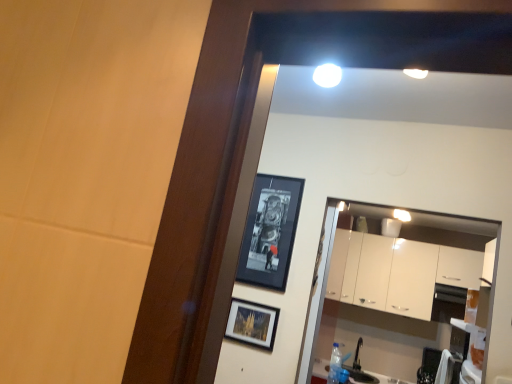
Question: Is black glossy picture frame at upper center, the first picture frame from the top, outside of white glossy cabinets at center?

Choices:
 (A) yes
 (B) no

Answer: (A)

Question: Considering the relative sizes of black glossy picture frame at upper center, the first picture frame from the top, and white glossy cabinets at center in the image provided, is black glossy picture frame at upper center, the first picture frame from the top, bigger than white glossy cabinets at center?

Choices:
 (A) no
 (B) yes

Answer: (A)

Question: From the image's perspective, is black glossy picture frame at upper center, the first picture frame from the top, over white glossy cabinets at center?

Choices:
 (A) no
 (B) yes

Answer: (B)

Question: Is black glossy picture frame at upper center, the first picture frame from the top, taller than white glossy cabinets at center?

Choices:
 (A) no
 (B) yes

Answer: (A)

Question: Are black glossy picture frame at upper center, which is counted as the second picture frame, starting from the bottom, and white glossy cabinets at center located far from each other?

Choices:
 (A) no
 (B) yes

Answer: (B)

Question: From the image's perspective, is white glossy cabinets at center above or below black glossy picture frame at upper center, the first picture frame from the top?

Choices:
 (A) below
 (B) above

Answer: (A)

Question: From a real-world perspective, is white glossy cabinets at center above or below black glossy picture frame at upper center, which is counted as the second picture frame, starting from the bottom?

Choices:
 (A) below
 (B) above

Answer: (B)

Question: Visually, is white glossy cabinets at center positioned to the left or to the right of black glossy picture frame at upper center, the first picture frame from the top?

Choices:
 (A) left
 (B) right

Answer: (B)

Question: In terms of height, does white glossy cabinets at center look taller or shorter compared to black glossy picture frame at upper center, which is counted as the second picture frame, starting from the bottom?

Choices:
 (A) short
 (B) tall

Answer: (B)

Question: Considering their positions, is matte black picture frame at center, placed as the first picture frame when sorted from bottom to top, located in front of or behind black glossy picture frame at upper center, which is counted as the second picture frame, starting from the bottom?

Choices:
 (A) front
 (B) behind

Answer: (A)

Question: From the image's perspective, is matte black picture frame at center, the second picture frame from the top, positioned above or below black glossy picture frame at upper center, which is counted as the second picture frame, starting from the bottom?

Choices:
 (A) below
 (B) above

Answer: (A)

Question: Would you say matte black picture frame at center, placed as the first picture frame when sorted from bottom to top, is to the left or to the right of black glossy picture frame at upper center, the first picture frame from the top, in the picture?

Choices:
 (A) left
 (B) right

Answer: (A)

Question: Is matte black picture frame at center, the second picture frame from the top, bigger or smaller than black glossy picture frame at upper center, the first picture frame from the top?

Choices:
 (A) small
 (B) big

Answer: (A)

Question: From a real-world perspective, is white glossy cabinets at center above or below matte black picture frame at center, the second picture frame from the top?

Choices:
 (A) above
 (B) below

Answer: (A)

Question: From the image's perspective, is white glossy cabinets at center located above or below matte black picture frame at center, the second picture frame from the top?

Choices:
 (A) above
 (B) below

Answer: (B)